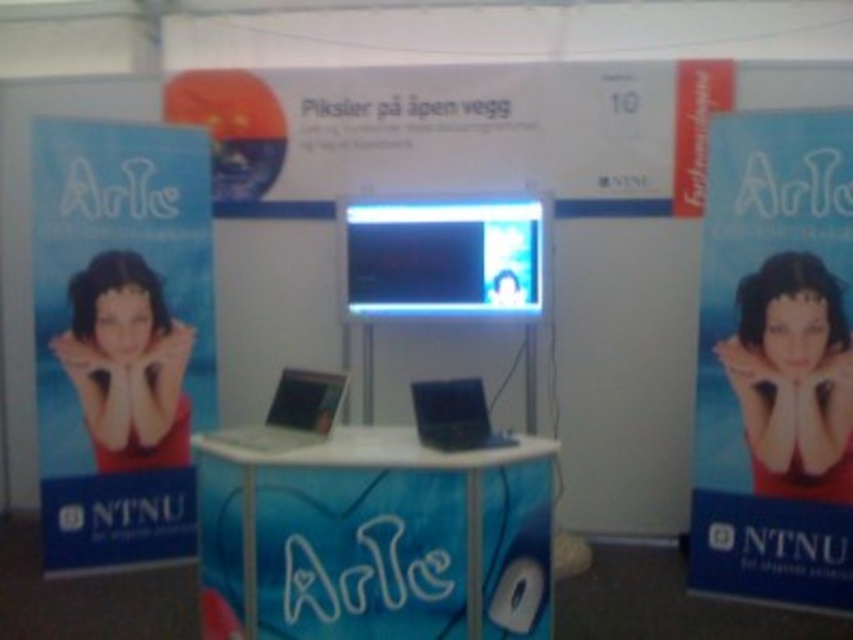
You are setting up a promotional booth for an event. You have a blue paper poster at left and a shiny blue laptop at center. Where should you place a new promotional banner so it doesn

The blue paper poster at left is above the shiny blue laptop at center. Therefore, placing the new promotional banner below the shiny blue laptop at center would ensure it aligns with the existing layout.

You are a photographer at an event and need to move from the blue paper poster at left to the camera on the counter. The space between them is 3.42 meters. If your camera bag is 1.2 meters long, can you comfortably walk through the space while carrying it?

The space between the blue paper poster at left and the camera is 3.42 meters. Since your camera bag is 1.2 meters long, the remaining space would be 3.42 minus 1.2 equals 2.22 meters. This should provide enough room to comfortably walk through the space while carrying the bag.

You are at an event and want to check the schedule. You see the blue paper poster at left and the shiny blue laptop at center on the counter. Which one is larger in size?

The blue paper poster at left is bigger than the shiny blue laptop at center.